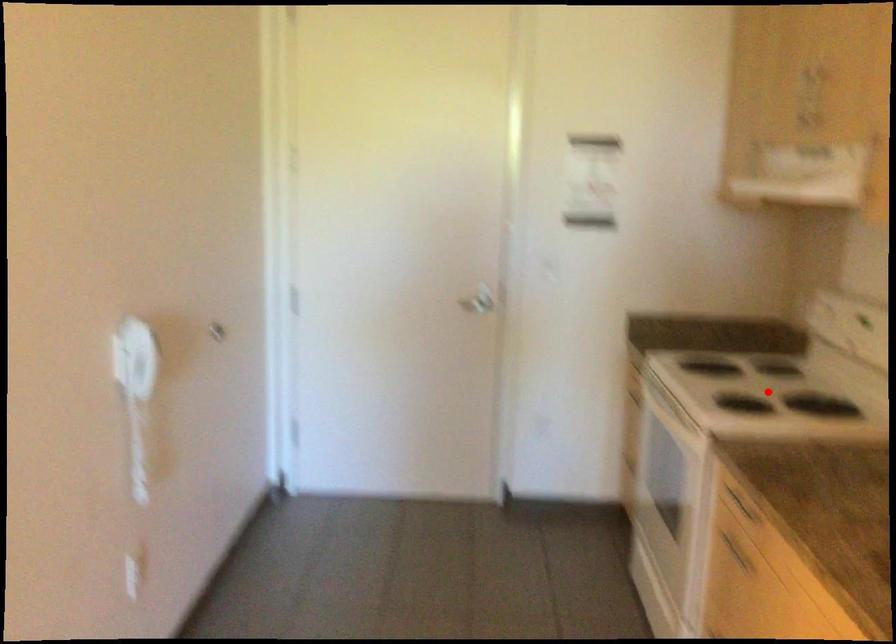
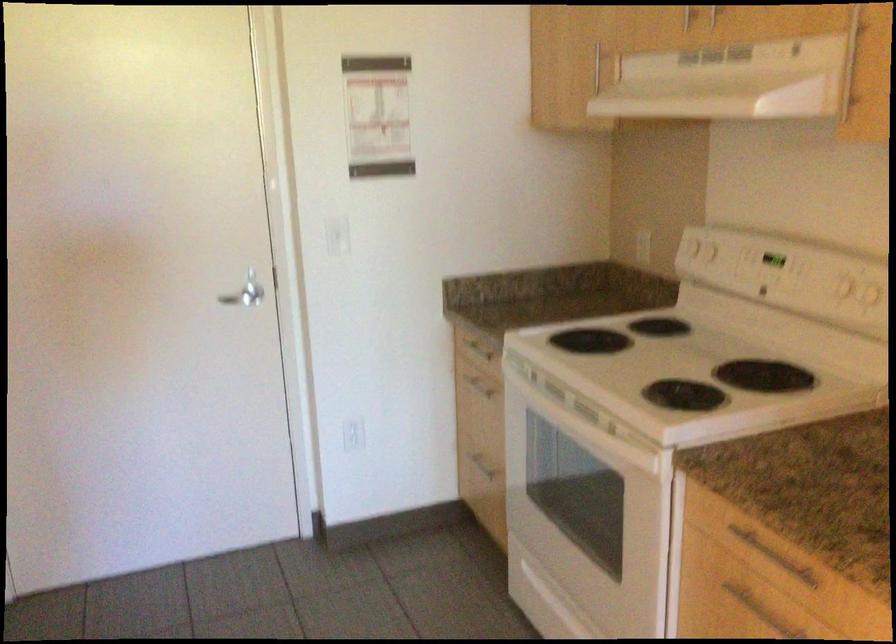
Question: I am providing you with two images of the same scene from different viewpoints. A red point is shown in image1. For the corresponding object point in image2, is it positioned nearer or farther from the camera?

Choices:
 (A) Nearer
 (B) Farther

Answer: (A)